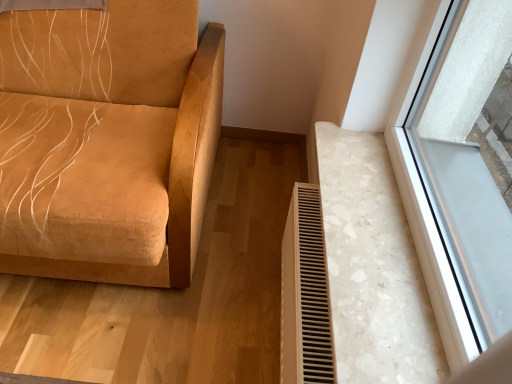
Image resolution: width=512 pixels, height=384 pixels. Find the location of `free space above white textured radiator at lower right (from a real-world perspective)`. free space above white textured radiator at lower right (from a real-world perspective) is located at coordinates (313, 256).